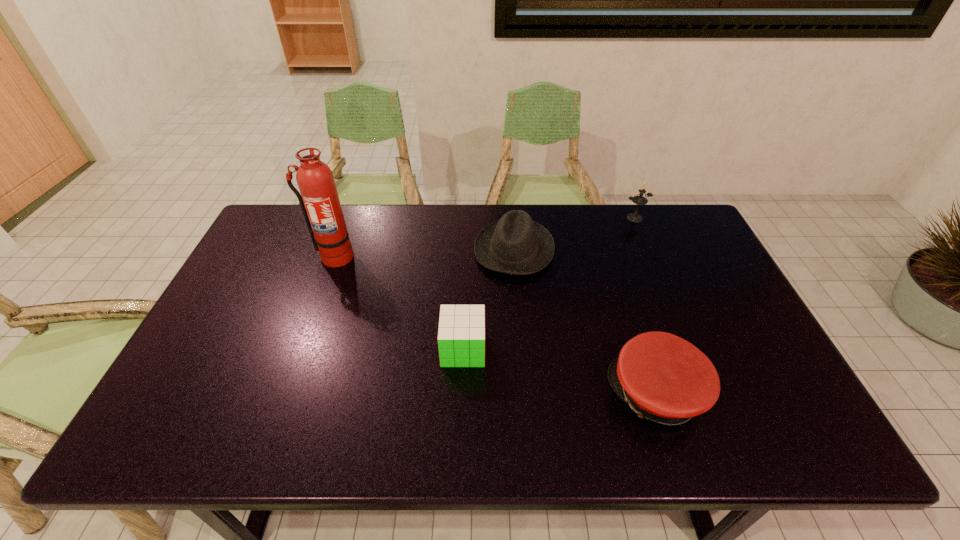
What are the coordinates of `vacant area that lies between the cap and the cube` in the screenshot? It's located at (560, 372).

Where is `vacant region between the fourth shortest object and the cap`? vacant region between the fourth shortest object and the cap is located at coordinates (646, 306).

I want to click on free space between the cap and the leftmost object, so pos(495,325).

At what (x,y) coordinates should I click in order to perform the action: click on vacant space that is in between the tallest object and the cap. Please return your answer as a coordinate pair (x, y). Looking at the image, I should click on (495, 325).

Identify the location of free space between the farthest object and the cube. (549, 284).

Identify the location of object identified as the closest to the tallest object. (515, 245).

Locate which object is the fourth closest to the cap. Please provide its 2D coordinates. Your answer should be formatted as a tuple, i.e. [(x, y)], where the tuple contains the x and y coordinates of a point satisfying the conditions above.

[(319, 200)]

The width and height of the screenshot is (960, 540). Find the location of `vacant region that satisfies the following two spatial constraints: 1. on the back side of the fedora; 2. on the right side of the cube`. vacant region that satisfies the following two spatial constraints: 1. on the back side of the fedora; 2. on the right side of the cube is located at coordinates (467, 249).